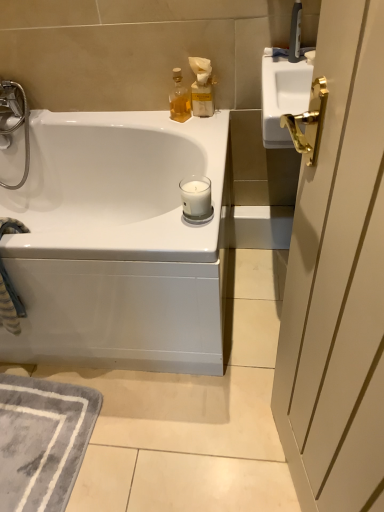
At what (x,y) coordinates should I click in order to perform the action: click on free spot to the right of gray soft rug at lower left. Please return your answer as a coordinate pair (x, y). Image resolution: width=384 pixels, height=512 pixels. Looking at the image, I should click on point(159,438).